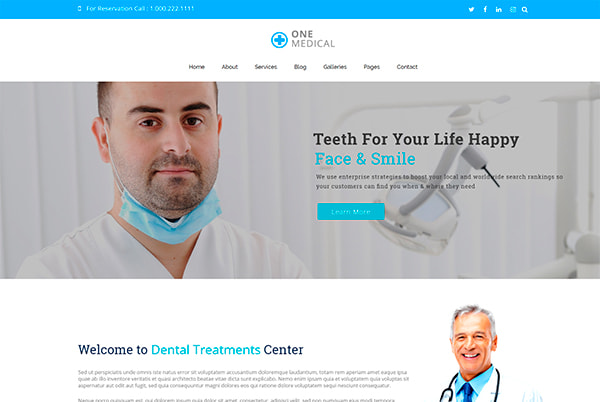
Find the location of a particular element. This screenshot has width=600, height=402. lines on wall is located at coordinates (76, 142), (39, 147), (243, 154), (280, 136).